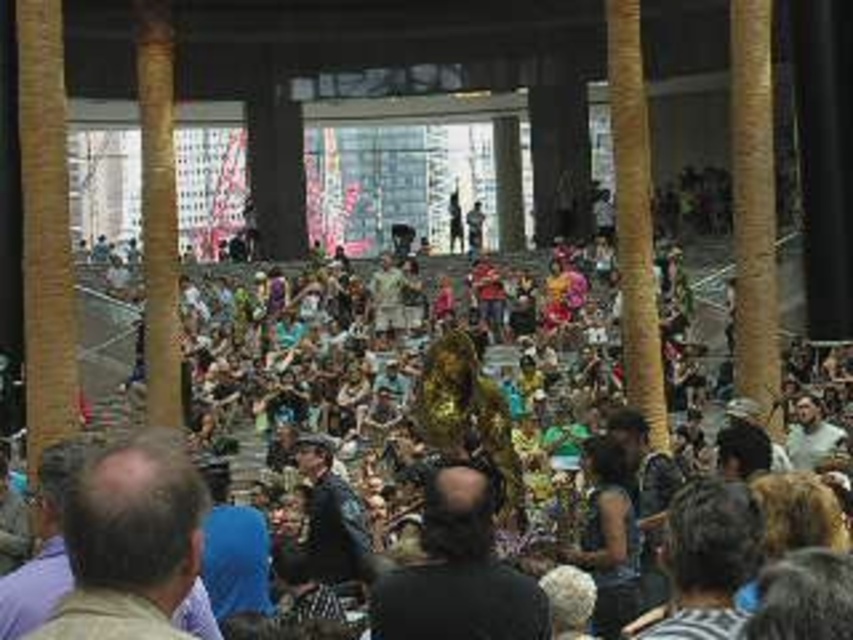
You are an event planner trying to ensure everyone has a good view. You notice the multicolored fabric crowd at center and the brown hair at lower left. Which group is blocking the view of the other?

The multicolored fabric crowd at center is positioned over brown hair at lower left, so the multicolored fabric crowd at center is blocking the view of the brown hair at lower left.

You are standing in the hall and want to reach the point marked as point (445,440). Given that the hall has tiered seating and columns, is the path to this point obstructed by any columns?

The point (445,440) is 60.25 meters away from the viewer. Since the hall has tiered seating and columns, it is possible that columns may obstruct the path, but the exact obstruction cannot be determined without additional information about column placement.

You are a photographer standing at the back of the hall and want to capture a photo of the brown hair at lower left without the multicolored fabric crowd at center blocking the view. Is this possible?

The multicolored fabric crowd at center is further to the viewer than the brown hair at lower left, so the photographer can capture the brown hair at lower left without obstruction since it is closer to the camera.